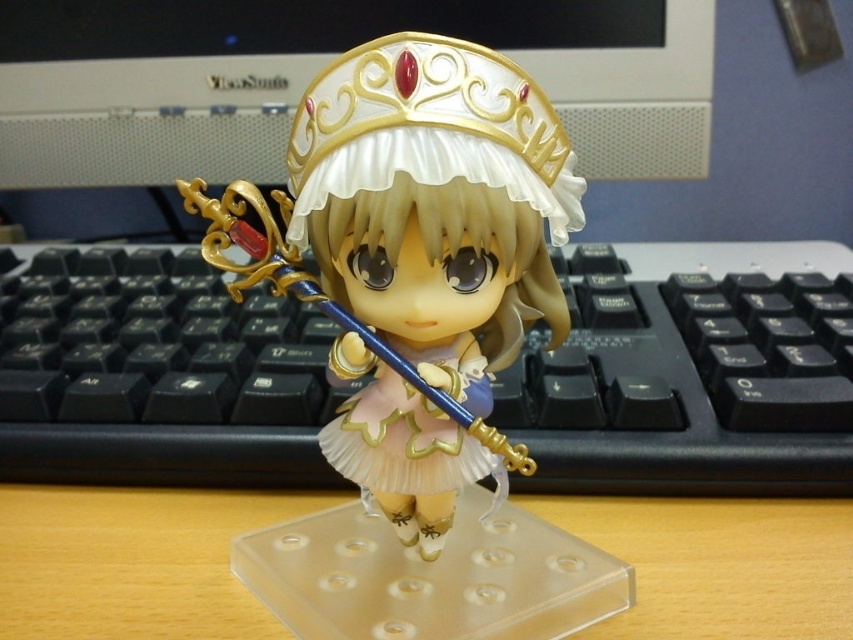
Question: Observing the image, what is the correct spatial positioning of black plastic keyboard at center in reference to matte gold crown at center?

Choices:
 (A) left
 (B) right

Answer: (B)

Question: Is matte gold crown at center further to camera compared to white glossy crown at upper center?

Choices:
 (A) yes
 (B) no

Answer: (B)

Question: Which of the following is the farthest from the observer?

Choices:
 (A) black plastic keyboard at center
 (B) wooden desk at center

Answer: (A)

Question: Which is farther from the black plastic keyboard at center?

Choices:
 (A) white glossy crown at upper center
 (B) matte gold crown at center

Answer: (A)

Question: In this image, where is black plastic keyboard at center located relative to white glossy crown at upper center?

Choices:
 (A) above
 (B) below

Answer: (B)

Question: Which object appears farthest from the camera in this image?

Choices:
 (A) wooden desk at center
 (B) black plastic keyboard at center

Answer: (B)